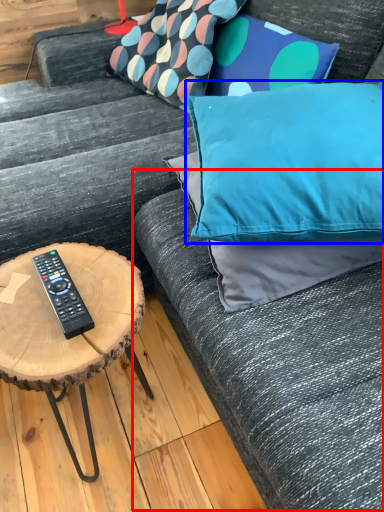
Question: Among these objects, which one is farthest to the camera, couch (highlighted by a red box) or pillow (highlighted by a blue box)?

Choices:
 (A) couch
 (B) pillow

Answer: (B)